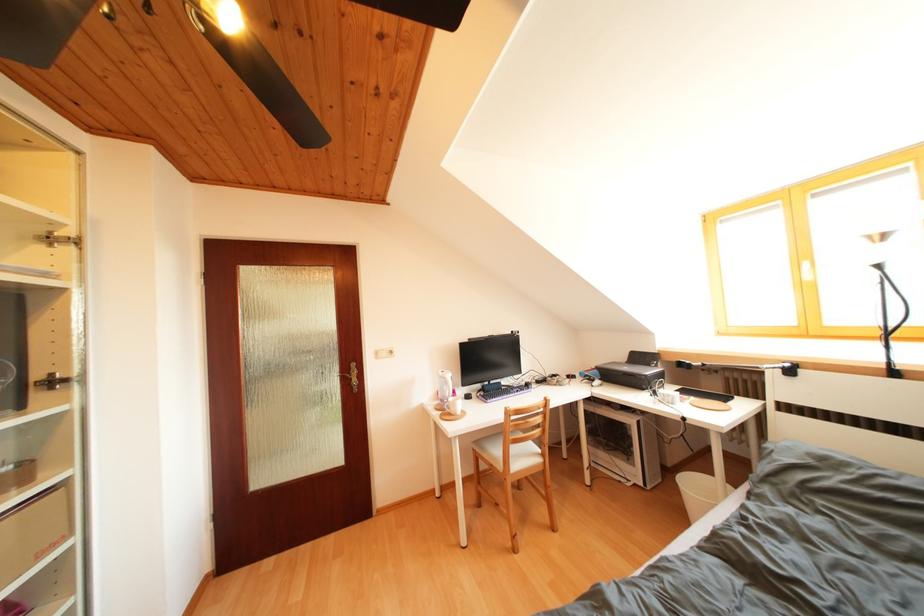
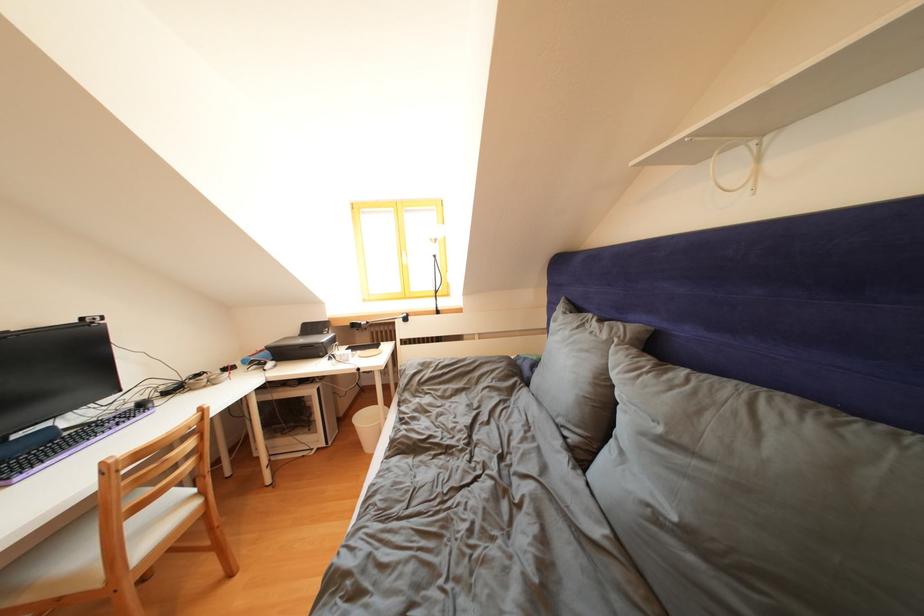
Where in the second image is the point corresponding to [647,363] from the first image?

(319, 333)